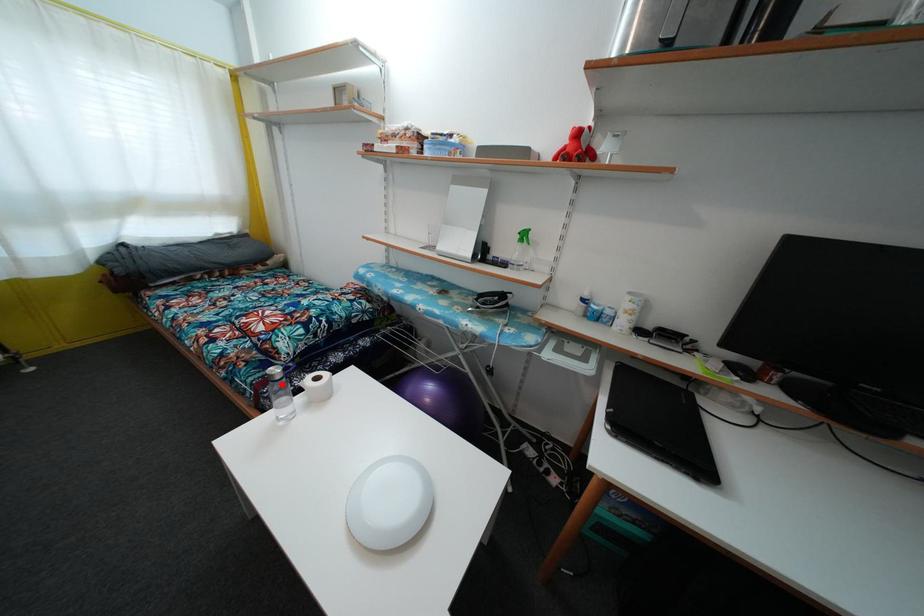
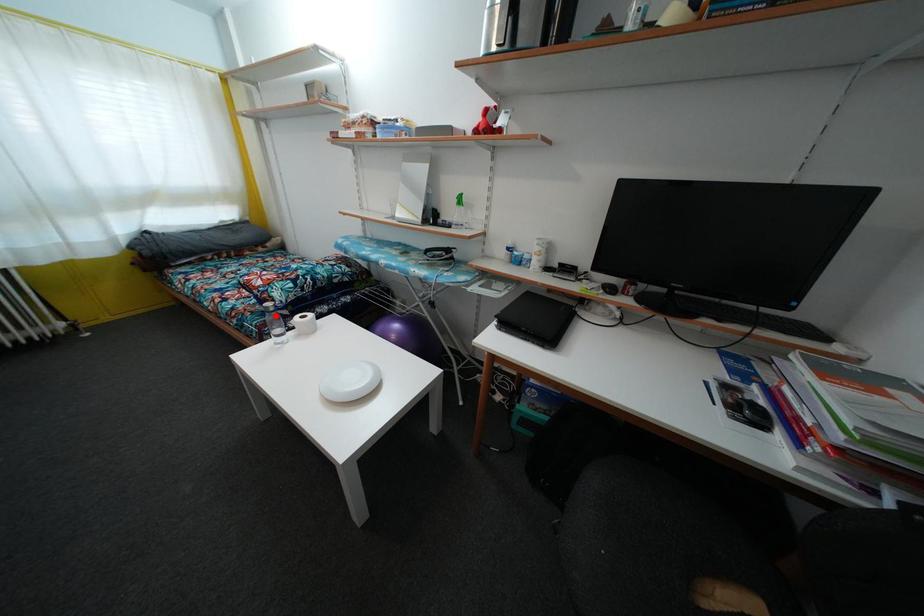
I am providing you with two images of the same scene from different viewpoints. A red point is marked on the first image and another point is marked on the second image. Are the points marked in image1 and image2 representing the same 3D position?

Yes